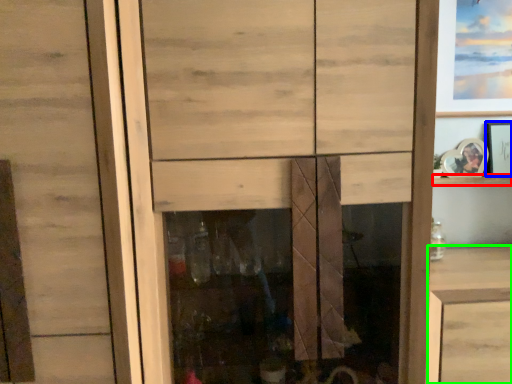
Question: Estimate the real-world distances between objects in this image. Which object is farther from shelf (highlighted by a red box), picture frame (highlighted by a blue box) or vanity (highlighted by a green box)?

Choices:
 (A) picture frame
 (B) vanity

Answer: (B)